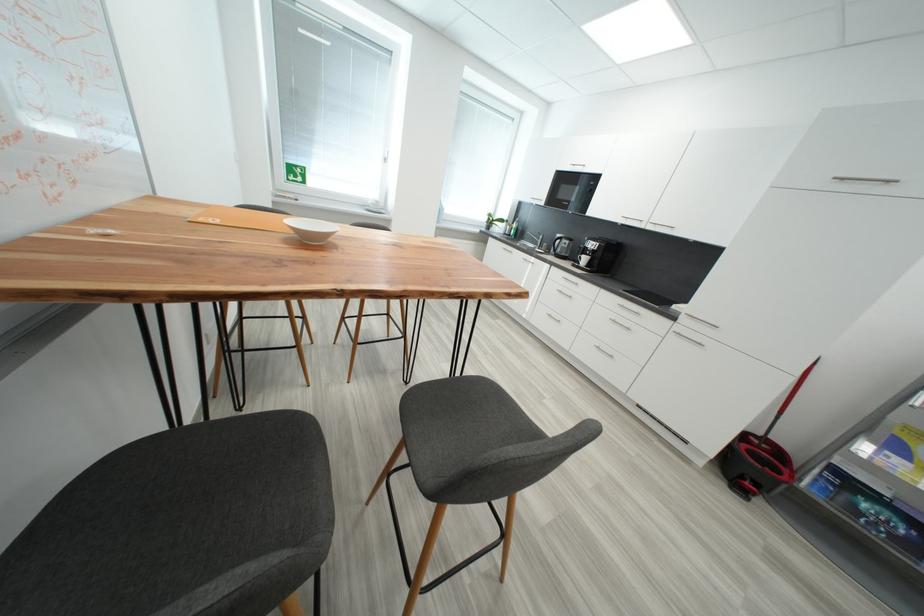
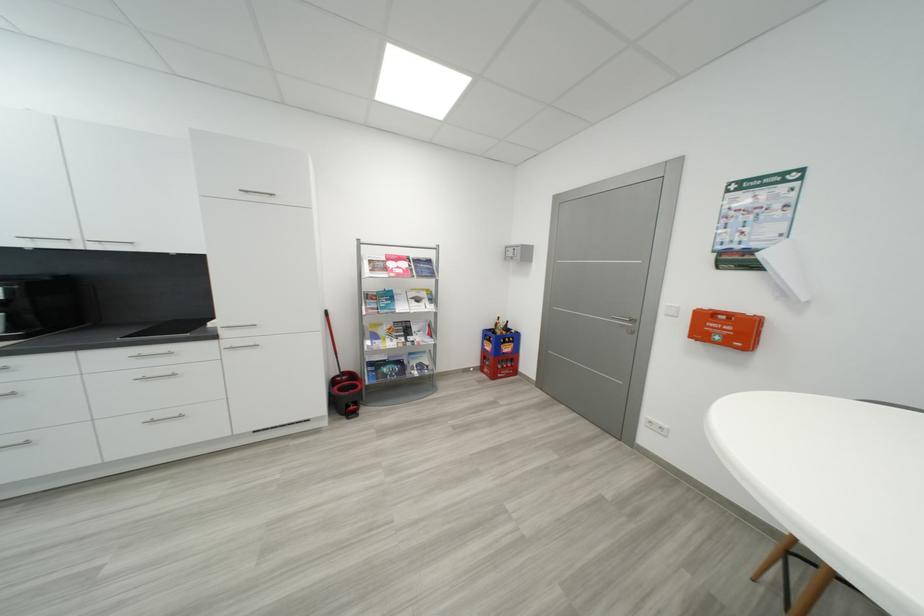
Where in the second image is the point corresponding to (773,442) from the first image?

(350, 375)